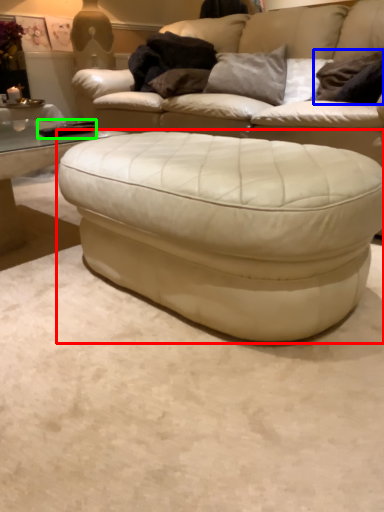
Question: Which object is the closest to the table (highlighted by a red box)? Choose among these: pillow (highlighted by a blue box) or pad (highlighted by a green box).

Choices:
 (A) pillow
 (B) pad

Answer: (B)